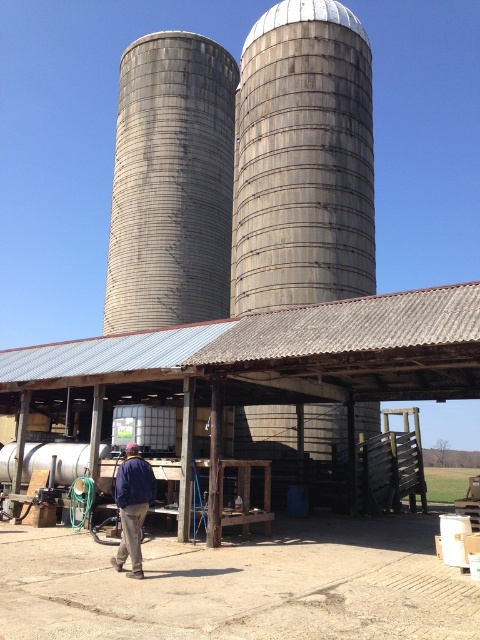
Can you confirm if gray concrete silo at center is smaller than blue denim jacket at lower left?

Incorrect, gray concrete silo at center is not smaller in size than blue denim jacket at lower left.

Can you confirm if gray concrete silo at center is positioned below blue denim jacket at lower left?

Incorrect, gray concrete silo at center is not positioned below blue denim jacket at lower left.

Who is more forward, (183, 35) or (127, 541)?

Point (127, 541)

Find the location of a particular element. Image resolution: width=480 pixels, height=640 pixels. gray concrete silo at center is located at coordinates (170, 184).

Between gray metallic silo at center and gray concrete silo at center, which one has less height?

gray metallic silo at center is shorter.

Is gray metallic silo at center further to camera compared to gray concrete silo at center?

No, it is not.

Between point (283, 294) and point (172, 83), which one is positioned in front?

Positioned in front is point (283, 294).

Where is `gray metallic silo at center`? Image resolution: width=480 pixels, height=640 pixels. gray metallic silo at center is located at coordinates (302, 160).

Is the position of rustic wood barn at center more distant than that of gray concrete silo at center?

No, rustic wood barn at center is closer to the viewer.

Which is more to the left, rustic wood barn at center or gray concrete silo at center?

Positioned to the left is gray concrete silo at center.

Is point (455, 365) positioned before point (227, 176)?

Yes, it is.

The height and width of the screenshot is (640, 480). Find the location of `rustic wood barn at center`. rustic wood barn at center is located at coordinates (262, 362).